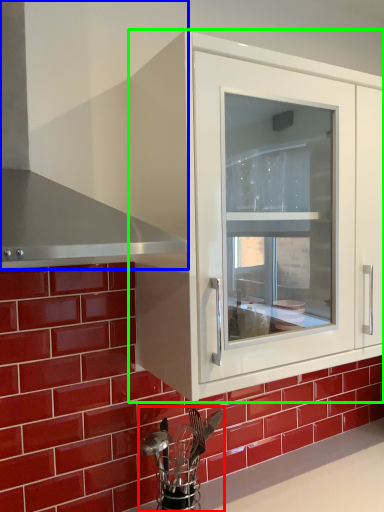
Question: Estimate the real-world distances between objects in this image. Which object is farther from appliance (highlighted by a red box), exhaust hood (highlighted by a blue box) or cabinetry (highlighted by a green box)?

Choices:
 (A) exhaust hood
 (B) cabinetry

Answer: (A)